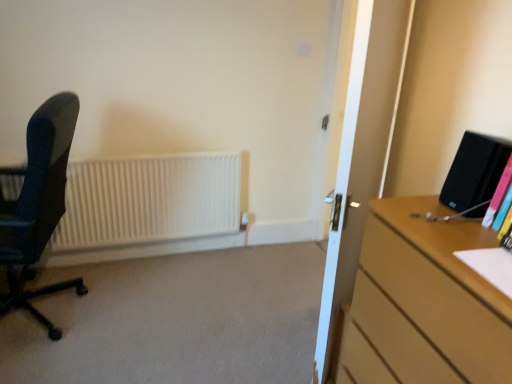
Where is `vacant space in between transparent glass door at center and matte black office chair at left`? vacant space in between transparent glass door at center and matte black office chair at left is located at coordinates (204, 319).